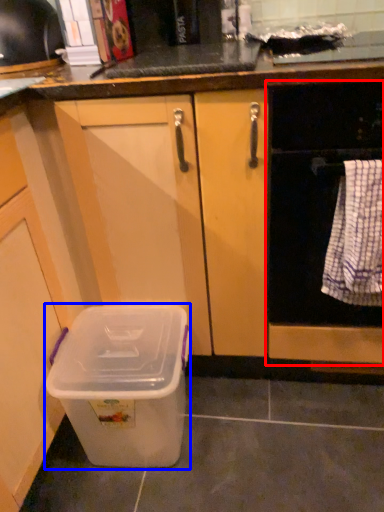
Question: Which of the following is the closest to the observer, home appliance (highlighted by a red box) or storage box (highlighted by a blue box)?

Choices:
 (A) home appliance
 (B) storage box

Answer: (A)